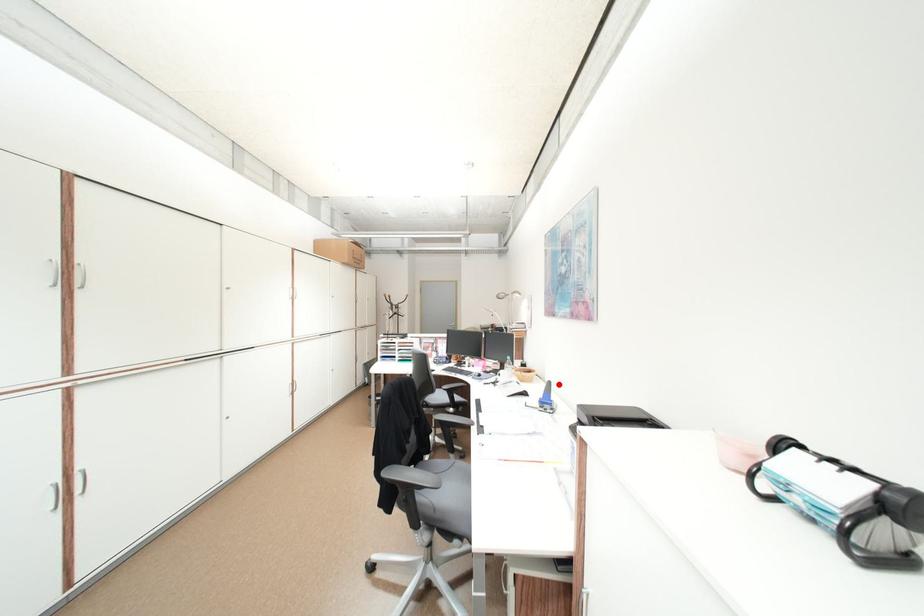
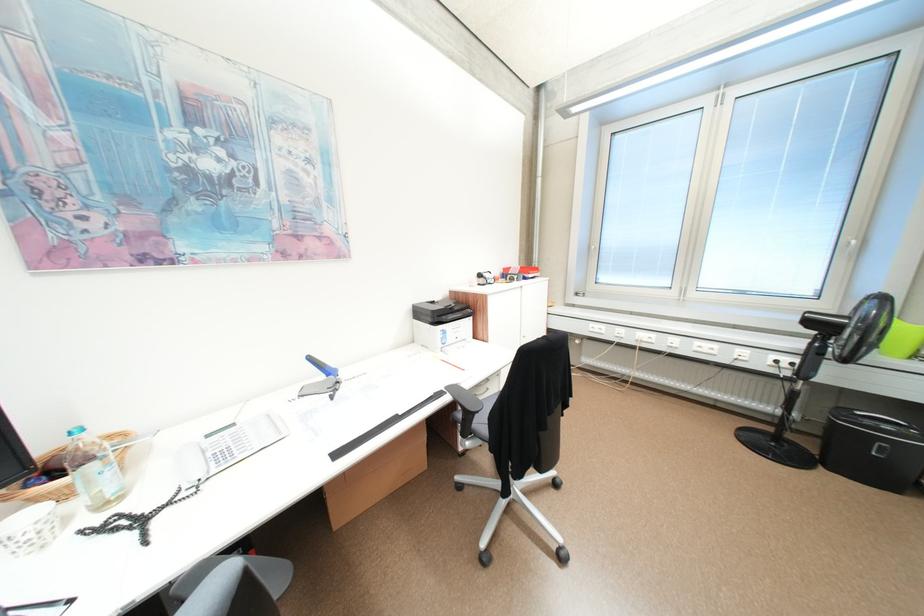
Question: I am providing you with two images of the same scene from different viewpoints. A red point is marked on the first image. Is the red point's position out of view in image 2?

Choices:
 (A) Yes
 (B) No

Answer: (B)